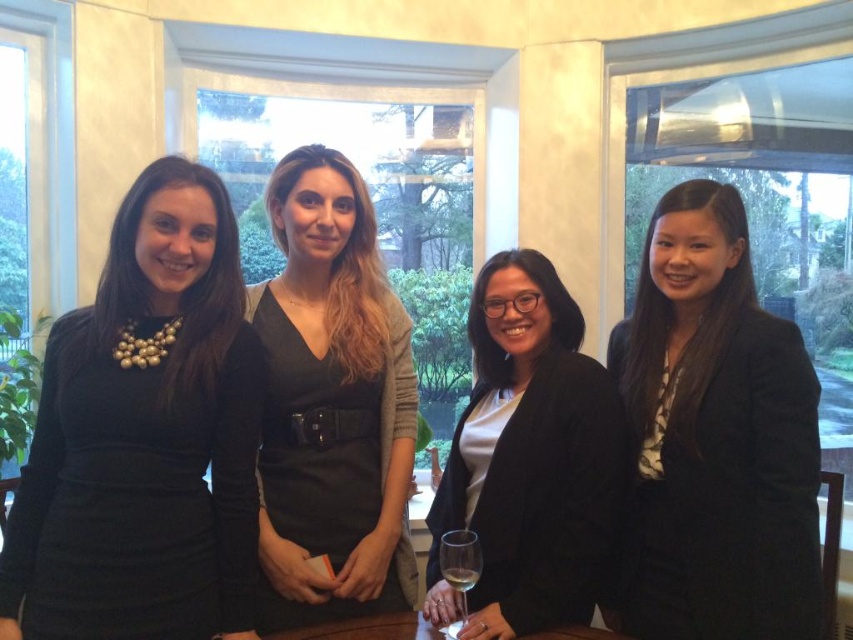
Is black matte blazer at right further to camera compared to black matte dress at center?

No, black matte blazer at right is closer to the viewer.

Between black matte blazer at right and black matte dress at center, which one appears on the right side from the viewer's perspective?

black matte blazer at right

Between point (648, 221) and point (332, 353), which one is positioned behind?

The point (648, 221) is more distant.

Locate an element on the screen. black matte blazer at right is located at coordinates (715, 436).

Between wooden table at center and clear glass wine glass at center, which one has less height?

wooden table at center is shorter.

Which is in front, point (410, 634) or point (459, 568)?

Point (459, 568)

Where is `wooden table at center`? Image resolution: width=853 pixels, height=640 pixels. wooden table at center is located at coordinates 366,628.

At what (x,y) coordinates should I click in order to perform the action: click on wooden table at center. Please return your answer as a coordinate pair (x, y). Looking at the image, I should click on point(366,628).

Between black matte blazer at right and black matte blazer at center, which one appears on the right side from the viewer's perspective?

black matte blazer at right

Is point (634, 588) positioned after point (577, 461)?

That is True.

Does point (664, 564) come farther from viewer compared to point (451, 605)?

That is True.

You are a GUI agent. You are given a task and a screenshot of the screen. Output one action in this format:
    pyautogui.click(x=<x>, y=<y>)
    Task: Click on the black matte blazer at right
    This screenshot has width=853, height=640.
    Given the screenshot: What is the action you would take?
    pyautogui.click(x=715, y=436)